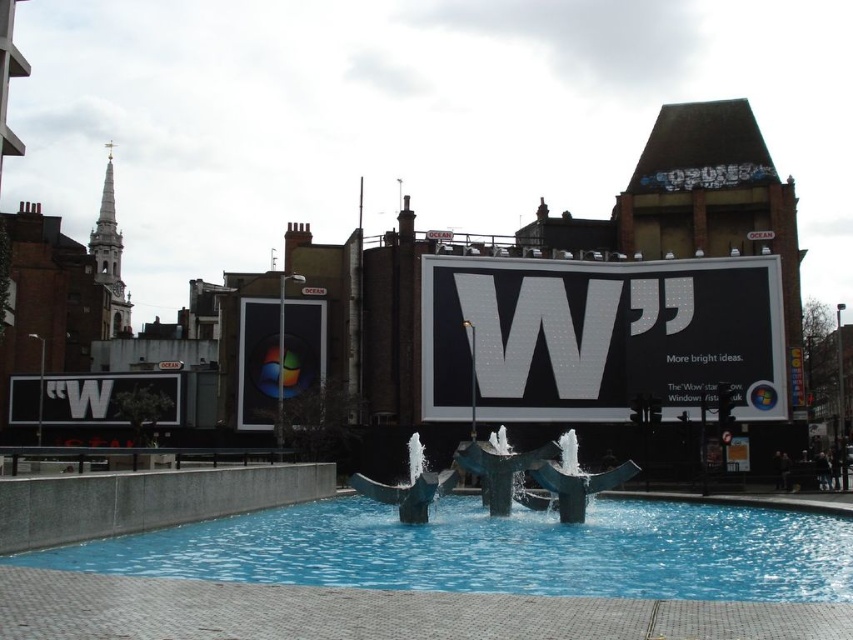
Is blue glossy water at center to the right of matte glass window at center from the viewer's perspective?

Correct, you'll find blue glossy water at center to the right of matte glass window at center.

Which is behind, point (281, 528) or point (239, 364)?

The point (239, 364) is more distant.

Identify the location of blue glossy water at center. (496, 550).

Based on the photo, which is below, matte black sign at center or matte glass window at center?

matte glass window at center is lower down.

Which is in front, point (523, 275) or point (276, 355)?

Point (523, 275) is more forward.

Is point (665, 282) less distant than point (323, 320)?

Yes, it is in front of point (323, 320).

Find the location of a particular element. The height and width of the screenshot is (640, 853). matte black sign at center is located at coordinates (601, 337).

Which of these two, blue glossy water at center or white matte sign at lower left, stands shorter?

With less height is blue glossy water at center.

Which is behind, point (524, 577) or point (77, 397)?

Point (77, 397)

In order to click on blue glossy water at center in this screenshot , I will do `click(496, 550)`.

The image size is (853, 640). I want to click on blue glossy water at center, so click(496, 550).